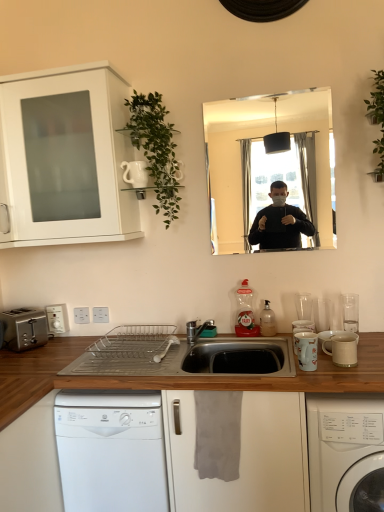
This screenshot has width=384, height=512. What are the coordinates of `free space between white glossy mug at right, which appears as the 2th appliance when viewed from the right, and white ceramic mug at right, which is counted as the first appliance, starting from the bottom` in the screenshot? It's located at (329, 369).